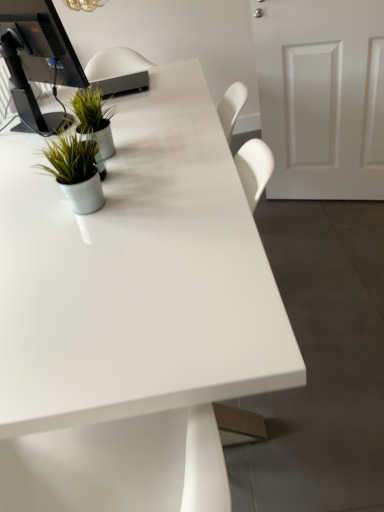
The image size is (384, 512). What are the coordinates of `free location to the right of green matte plant at upper left, marked as the second houseplant in a front-to-back arrangement` in the screenshot? It's located at (149, 138).